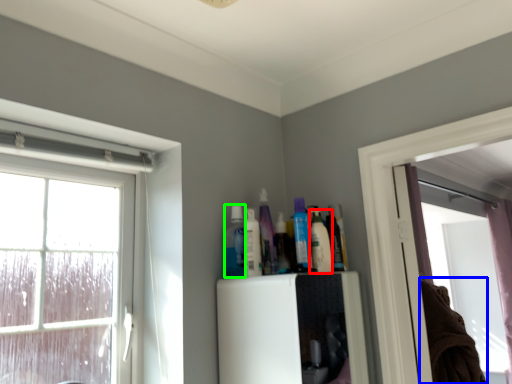
Question: Which is nearer to the toiletry (highlighted by a red box)? laundry (highlighted by a blue box) or toiletry (highlighted by a green box).

Choices:
 (A) laundry
 (B) toiletry

Answer: (B)